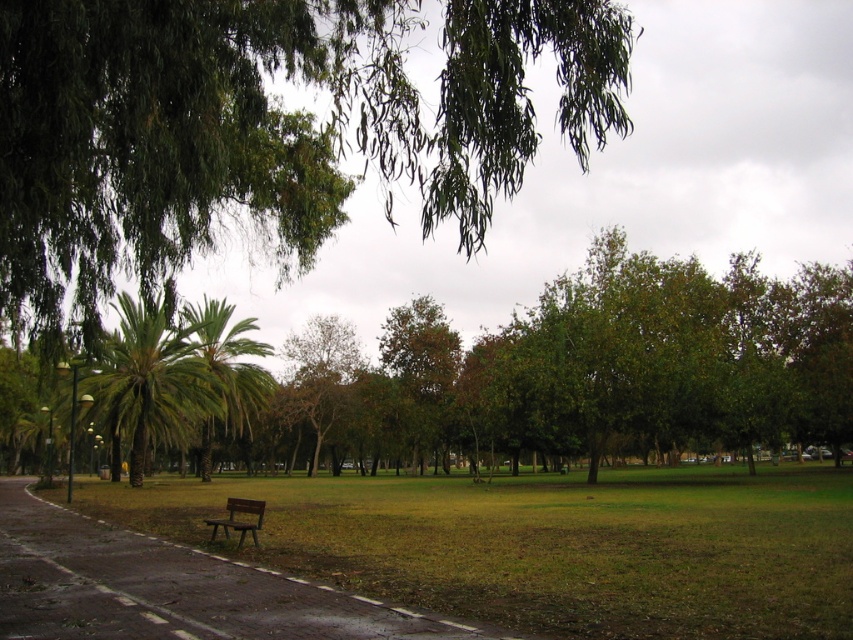
Question: Which object is closer to the camera taking this photo?

Choices:
 (A) green leafy palm tree at center
 (B) brown wooden bench at lower center

Answer: (B)

Question: Which of these objects is positioned closest to the green leafy palm tree at center-left?

Choices:
 (A) dark gray asphalt path at center
 (B) green leafy tree at center

Answer: (B)

Question: Is green leafy palm tree at center positioned at the back of brown wooden bench at lower center?

Choices:
 (A) no
 (B) yes

Answer: (B)

Question: Can you confirm if green leafy tree at center is positioned to the right of brown wooden bench at lower center?

Choices:
 (A) yes
 (B) no

Answer: (A)

Question: Which of the following is the closest to the observer?

Choices:
 (A) (262, 352)
 (B) (242, 531)
 (C) (643, 360)

Answer: (B)

Question: In this image, where is dark gray asphalt path at center located relative to brown wooden bench at lower center?

Choices:
 (A) right
 (B) left

Answer: (B)